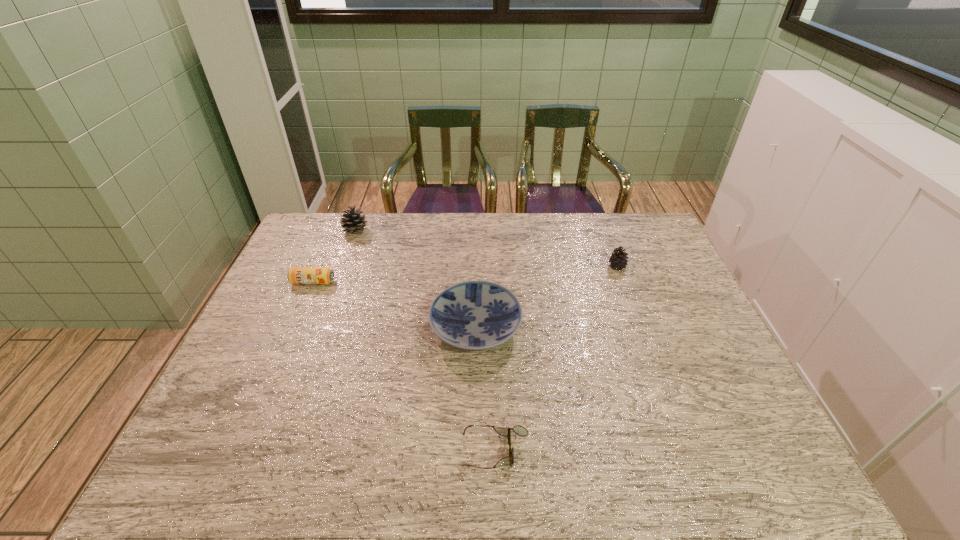
The image size is (960, 540). In order to click on the farther pinecone in this screenshot , I will do `click(352, 222)`.

Where is `the farthest object`? Image resolution: width=960 pixels, height=540 pixels. the farthest object is located at coordinates (352, 222).

At what (x,y) coordinates should I click in order to perform the action: click on the nearer pinecone. Please return your answer as a coordinate pair (x, y). Looking at the image, I should click on (618, 258).

The height and width of the screenshot is (540, 960). I want to click on the fourth nearest object, so click(618, 258).

At what (x,y) coordinates should I click in order to perform the action: click on the second nearest object. Please return your answer as a coordinate pair (x, y). The height and width of the screenshot is (540, 960). Looking at the image, I should click on (474, 315).

Where is `the fourth tallest object`? the fourth tallest object is located at coordinates (296, 275).

The height and width of the screenshot is (540, 960). I want to click on the third farthest object, so click(x=296, y=275).

Where is `spectacles`? spectacles is located at coordinates (519, 430).

Find the location of a particular element. Image resolution: width=960 pixels, height=540 pixels. the nearest object is located at coordinates pos(519,430).

This screenshot has height=540, width=960. In order to click on vacant space located on the left of the taller pinecone in this screenshot , I will do [x=329, y=231].